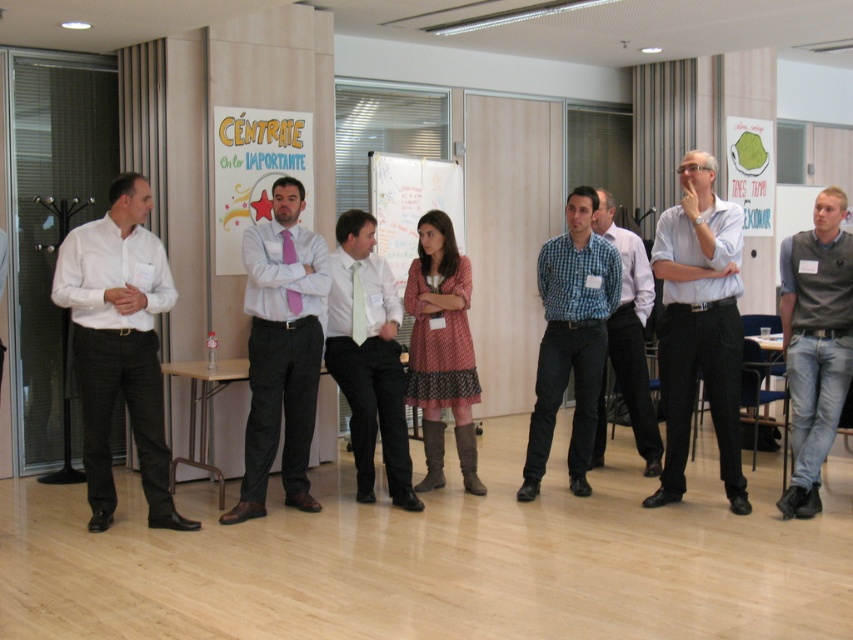
Question: Is light blue shirt at center positioned at the back of matte black suit at left?

Choices:
 (A) no
 (B) yes

Answer: (B)

Question: Is white shirt at left thinner than jeans at center?

Choices:
 (A) yes
 (B) no

Answer: (B)

Question: Is jeans at center smaller than light green silk tie at center?

Choices:
 (A) yes
 (B) no

Answer: (A)

Question: Which object is positioned closest to the checkered fabric shirt at center?

Choices:
 (A) white shirt at left
 (B) matte black suit at left
 (C) dotted fabric dress at center

Answer: (C)

Question: Which object is positioned farthest from the light green silk tie at center?

Choices:
 (A) pink fabric shirt at center
 (B) checkered fabric shirt at center
 (C) jeans at center
 (D) matte black suit at left

Answer: (C)

Question: Which object is the farthest from the light green silk tie at center?

Choices:
 (A) jeans at center
 (B) checkered fabric shirt at center
 (C) white shirt at left
 (D) blue checkered shirt at center

Answer: (A)